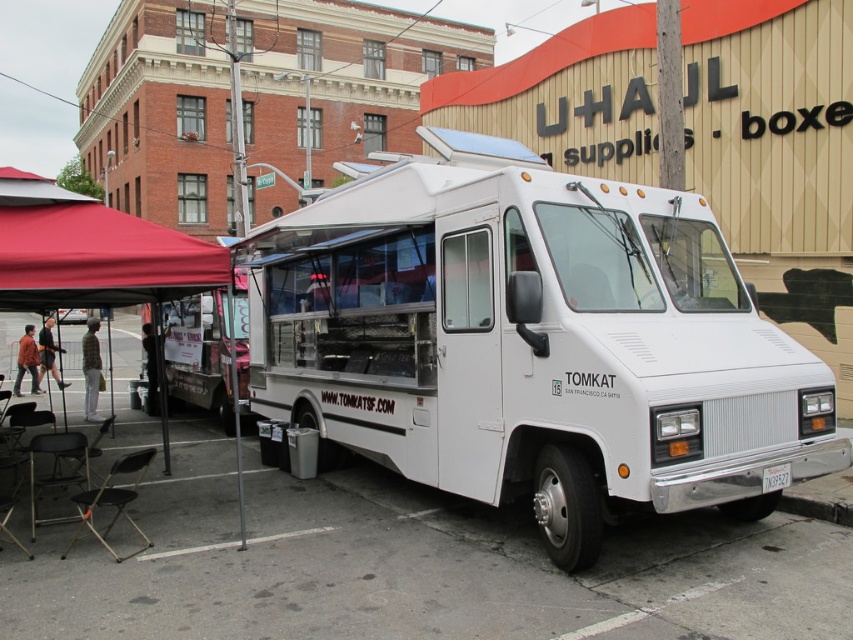
Question: Is white matte food truck at center positioned in front of red fabric canopy at left?

Choices:
 (A) yes
 (B) no

Answer: (A)

Question: Which of the following is the closest to the observer?

Choices:
 (A) white matte food truck at center
 (B) red fabric canopy at left

Answer: (A)

Question: Is white matte food truck at center positioned in front of red fabric canopy at left?

Choices:
 (A) no
 (B) yes

Answer: (B)

Question: Does white matte food truck at center appear on the right side of red fabric canopy at left?

Choices:
 (A) no
 (B) yes

Answer: (B)